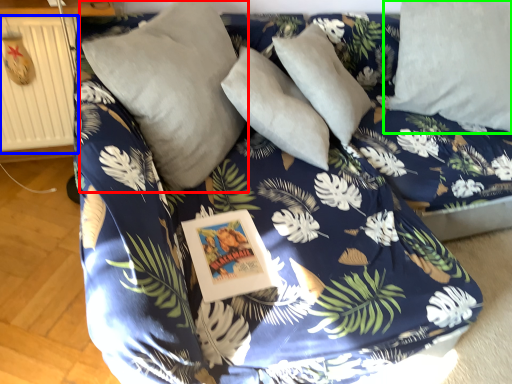
Question: Which object is positioned closest to pillow (highlighted by a red box)? Select from radiator (highlighted by a blue box) and pillow (highlighted by a green box).

Choices:
 (A) radiator
 (B) pillow

Answer: (A)